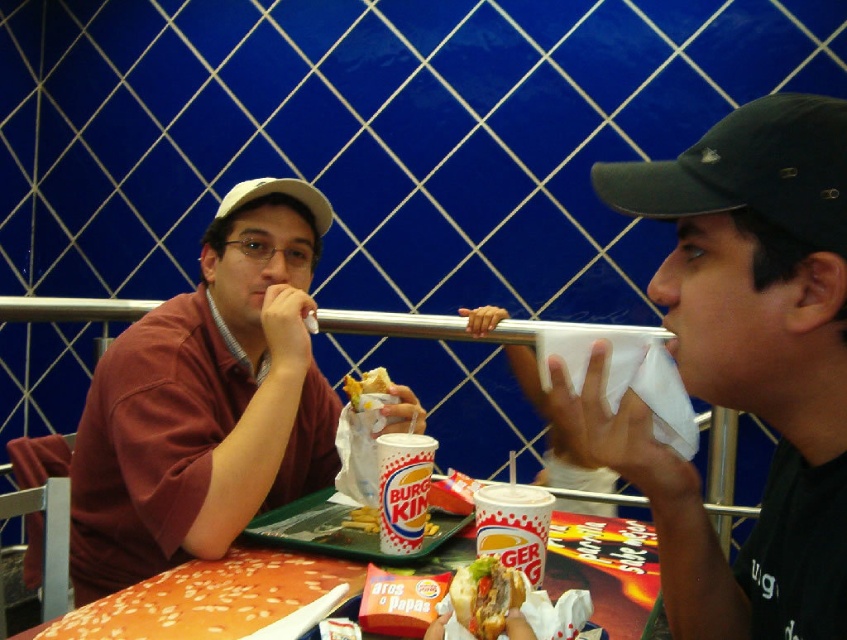
You are a delivery person who needs to place a new order on the table between the smooth orange hamburger bun at lower left and the white matte baseball cap at upper left. Can you fit it there?

The smooth orange hamburger bun at lower left and the white matte baseball cap at upper left are 22.65 inches apart from each other. Since the distance is sufficient, you can fit the new order between them.

You are a photographer taking a picture of the scene. You want to focus on the closer point between point (383, 477) and point (450, 586). Which point should you focus on?

You should focus on point (383, 477) because it is closer to the camera than point (450, 586).